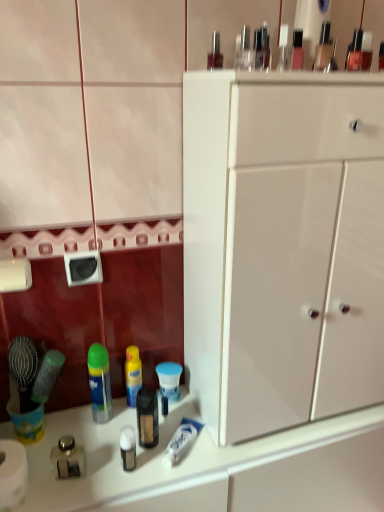
This screenshot has width=384, height=512. In order to click on unoccupied region to the right of white matte toilet paper at lower left in this screenshot , I will do `click(89, 497)`.